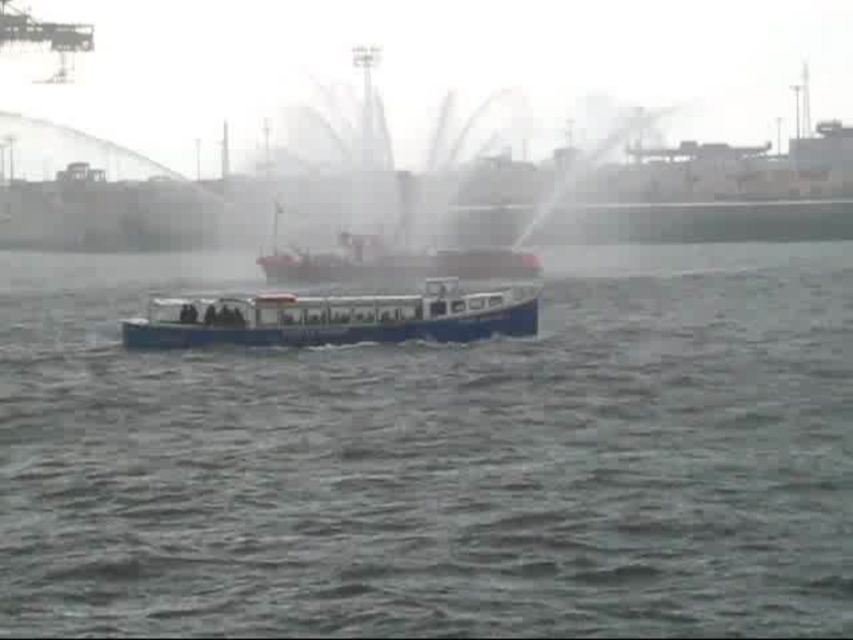
You are an observer standing on the dock watching the scene. You see the white plastic boat at center and the blue matte water at center. Which object is positioned lower in the image?

The blue matte water at center is located below the white plastic boat at center, so it is positioned lower in the image.

You are a harbor inspector checking the scene. You notice the blue matte water at center and the white plastic boat at center. Which one has a greater width?

The blue matte water at center has a greater width than the white plastic boat at center.